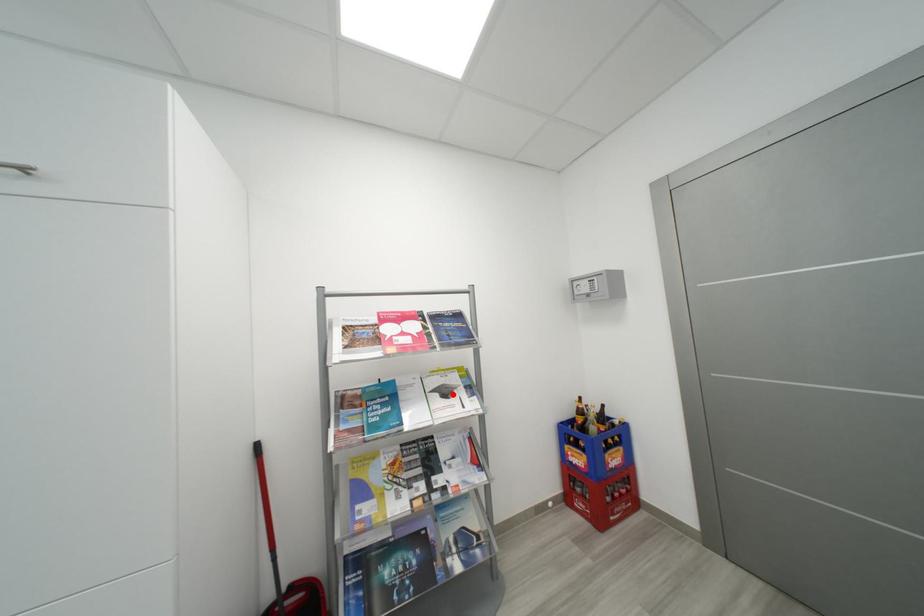
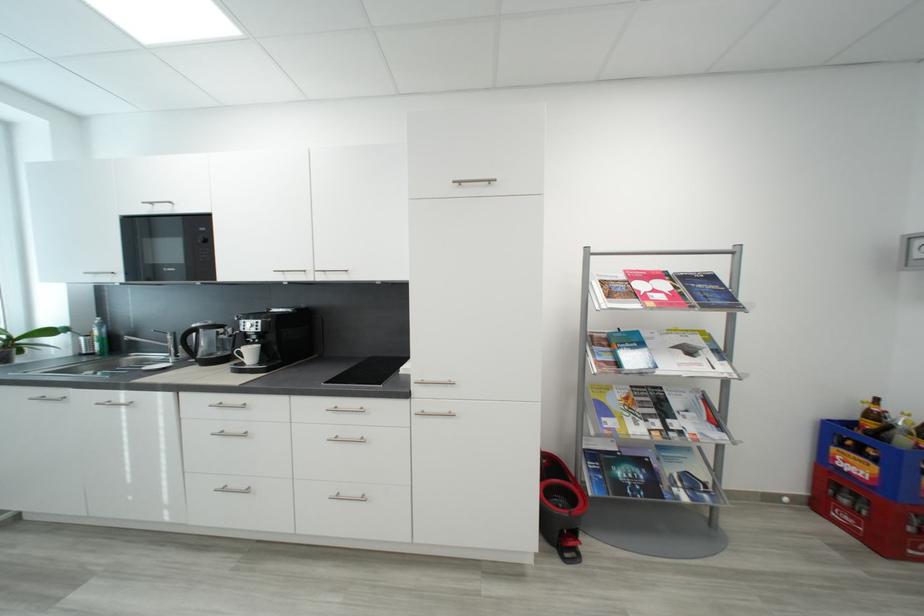
Locate, in the second image, the point that corresponds to the highlighted location in the first image.

(697, 353)